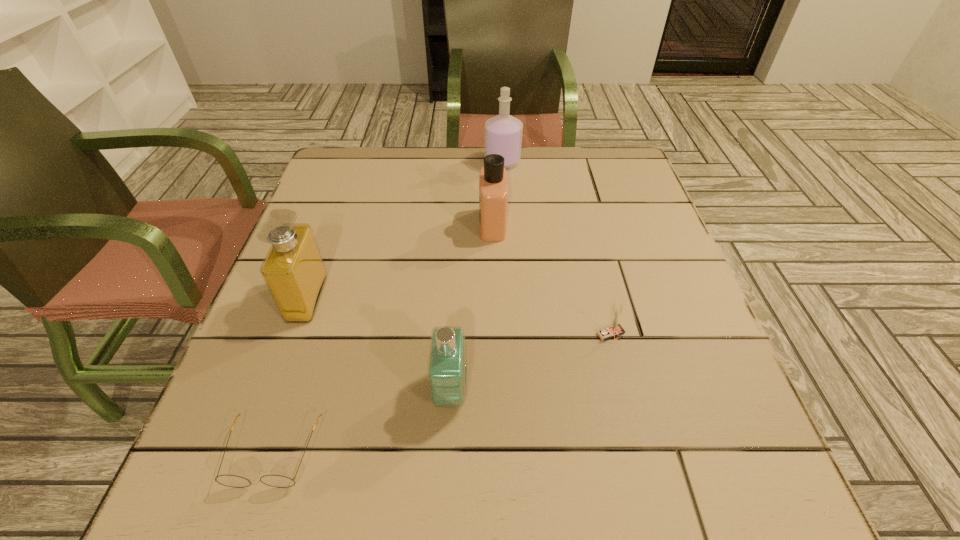
The image size is (960, 540). What are the coordinates of `empty space that is in between the second farthest object and the spectacles` in the screenshot? It's located at (383, 339).

I want to click on free spot between the leftmost perfume and the farthest perfume, so click(x=405, y=230).

This screenshot has width=960, height=540. In order to click on vacant region between the leftmost perfume and the third nearest perfume in this screenshot , I will do `click(400, 261)`.

You are a GUI agent. You are given a task and a screenshot of the screen. Output one action in this format:
    pyautogui.click(x=<x>, y=<y>)
    Task: Click on the free space that is in between the leftmost perfume and the second perfume from left to right
    The image size is (960, 540).
    Given the screenshot: What is the action you would take?
    pyautogui.click(x=379, y=345)

Locate an element on the screen. Image resolution: width=960 pixels, height=540 pixels. vacant area that lies between the second perfume from left to right and the leftmost perfume is located at coordinates (379, 345).

You are a GUI agent. You are given a task and a screenshot of the screen. Output one action in this format:
    pyautogui.click(x=<x>, y=<y>)
    Task: Click on the empty location between the farthest object and the rightmost object
    The image size is (960, 540).
    Given the screenshot: What is the action you would take?
    pyautogui.click(x=557, y=248)

The height and width of the screenshot is (540, 960). I want to click on vacant space in between the fifth tallest object and the farthest object, so click(x=557, y=248).

What are the coordinates of `free area in between the shortest object and the third nearest perfume` in the screenshot? It's located at (383, 339).

Select which object is the fifth closest to the third perfume from right to left. Please provide its 2D coordinates. Your answer should be formatted as a tuple, i.e. [(x, y)], where the tuple contains the x and y coordinates of a point satisfying the conditions above.

[(503, 133)]

Where is `object that is the fourth closest to the fourth nearest object`? This screenshot has width=960, height=540. object that is the fourth closest to the fourth nearest object is located at coordinates 503,133.